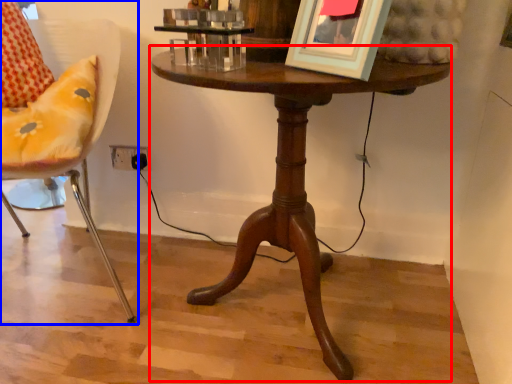
Question: Which object is further to the camera taking this photo, table (highlighted by a red box) or chair (highlighted by a blue box)?

Choices:
 (A) table
 (B) chair

Answer: (B)